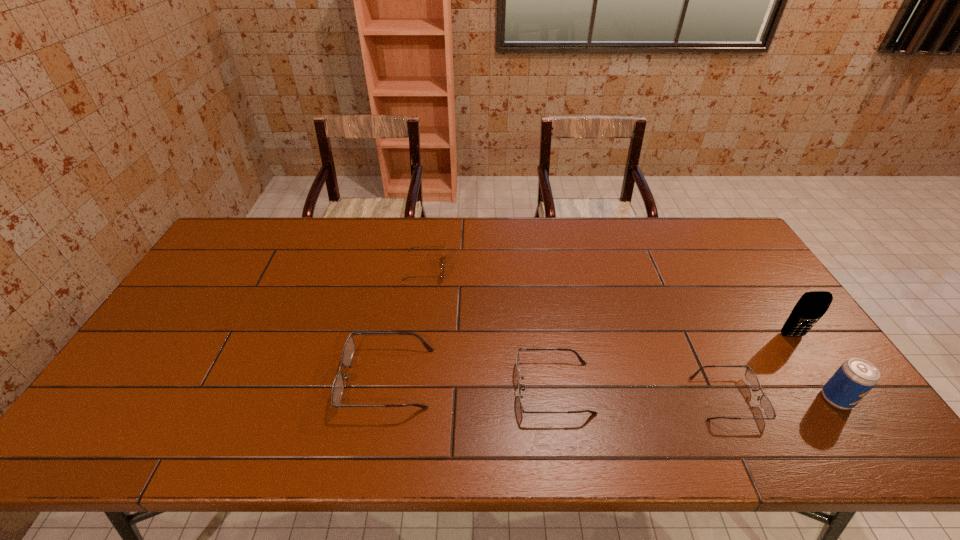
The height and width of the screenshot is (540, 960). What are the coordinates of `the tallest spectacles` in the screenshot? It's located at (338, 385).

You are a GUI agent. You are given a task and a screenshot of the screen. Output one action in this format:
    pyautogui.click(x=<x>, y=<y>)
    Task: Click on the fourth tallest object
    
    Given the screenshot: What is the action you would take?
    pyautogui.click(x=338, y=385)

The image size is (960, 540). What are the coordinates of `the second spectacles from left to right` in the screenshot? It's located at (581, 360).

Find the location of `the second shortest spectacles`. the second shortest spectacles is located at coordinates (581, 360).

You are a GUI agent. You are given a task and a screenshot of the screen. Output one action in this format:
    pyautogui.click(x=<x>, y=<y>)
    Task: Click on the shortest object
    The height and width of the screenshot is (540, 960).
    Given the screenshot: What is the action you would take?
    pyautogui.click(x=751, y=377)

At what (x,y) coordinates should I click in order to perform the action: click on the shortest spectacles. Please return your answer as a coordinate pair (x, y). The height and width of the screenshot is (540, 960). Looking at the image, I should click on (751, 377).

This screenshot has height=540, width=960. What are the coordinates of `sunglasses` in the screenshot? It's located at (444, 261).

Identify the location of the tallest object. (811, 306).

Locate an element on the screen. cellular telephone is located at coordinates (811, 306).

Find the location of a particular element. beer can is located at coordinates (855, 378).